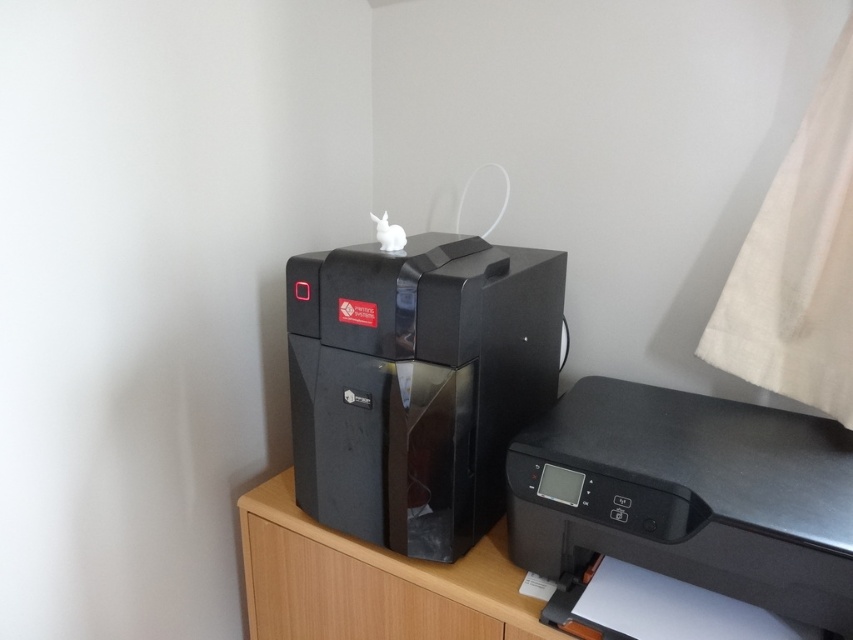
Question: Which of the following is the closest to the observer?

Choices:
 (A) wooden drawer at center
 (B) black glossy printer at center

Answer: (B)

Question: Can you confirm if black glossy printer at center is positioned to the right of black plastic printer at lower right?

Choices:
 (A) yes
 (B) no

Answer: (B)

Question: Where is black glossy printer at center located in relation to black plastic printer at lower right in the image?

Choices:
 (A) below
 (B) above

Answer: (B)

Question: Which object is positioned farthest from the black glossy printer at center?

Choices:
 (A) wooden drawer at center
 (B) black plastic printer at lower right

Answer: (A)

Question: Is black glossy printer at center further to camera compared to black plastic printer at lower right?

Choices:
 (A) yes
 (B) no

Answer: (A)

Question: Which is nearer to the wooden drawer at center?

Choices:
 (A) black glossy printer at center
 (B) black plastic printer at lower right

Answer: (A)